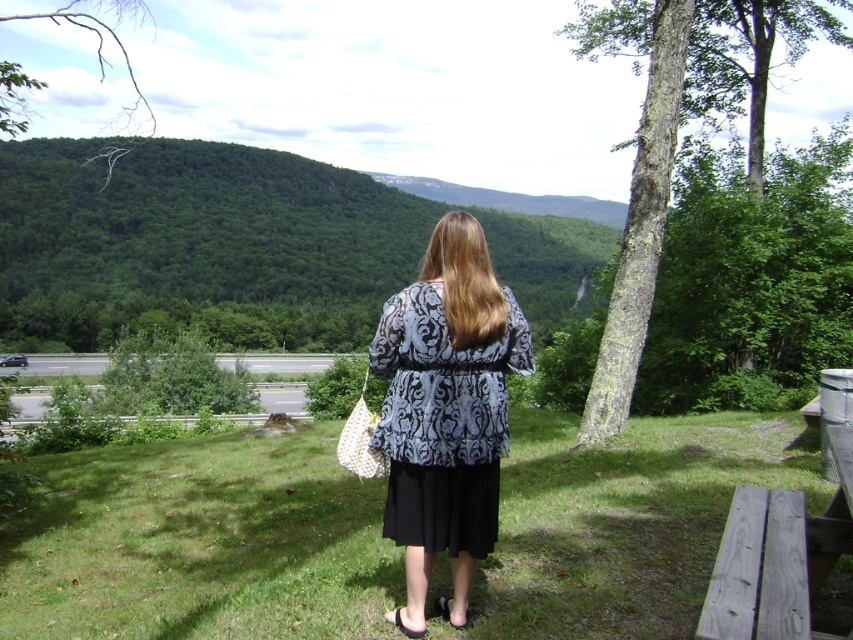
Who is lower down, green rough bark tree at upper right or grayish-brown bark tree at right?

Positioned lower is grayish-brown bark tree at right.

Is point (646, 280) closer to viewer compared to point (614, 381)?

That is False.

At what (x,y) coordinates should I click in order to perform the action: click on green rough bark tree at upper right. Please return your answer as a coordinate pair (x, y). Image resolution: width=853 pixels, height=640 pixels. Looking at the image, I should click on (675, 138).

Is patterned fabric dress at center closer to camera compared to green rough bark tree at upper right?

Yes.

Between patterned fabric dress at center and green rough bark tree at upper right, which one is positioned higher?

green rough bark tree at upper right

Is point (486, 360) less distant than point (669, 38)?

Yes, it is.

This screenshot has height=640, width=853. Identify the location of patterned fabric dress at center. (445, 412).

Is green rough bark tree at upper right shorter than gray wood picnic table at lower right?

In fact, green rough bark tree at upper right may be taller than gray wood picnic table at lower right.

Is green rough bark tree at upper right wider than gray wood picnic table at lower right?

Yes, green rough bark tree at upper right is wider than gray wood picnic table at lower right.

What do you see at coordinates (675, 138) in the screenshot?
I see `green rough bark tree at upper right` at bounding box center [675, 138].

The width and height of the screenshot is (853, 640). I want to click on green rough bark tree at upper right, so click(x=675, y=138).